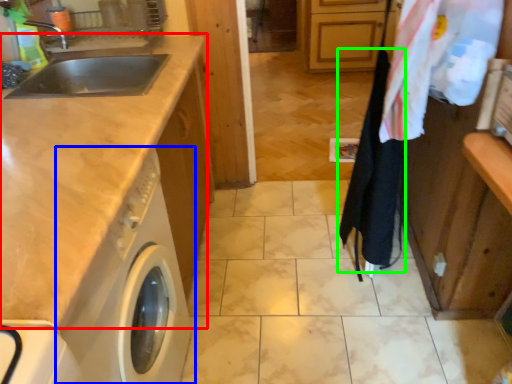
Question: Which object is positioned closest to countertop (highlighted by a red box)? Select from washing machine (highlighted by a blue box) and clothesline (highlighted by a green box).

Choices:
 (A) washing machine
 (B) clothesline

Answer: (A)